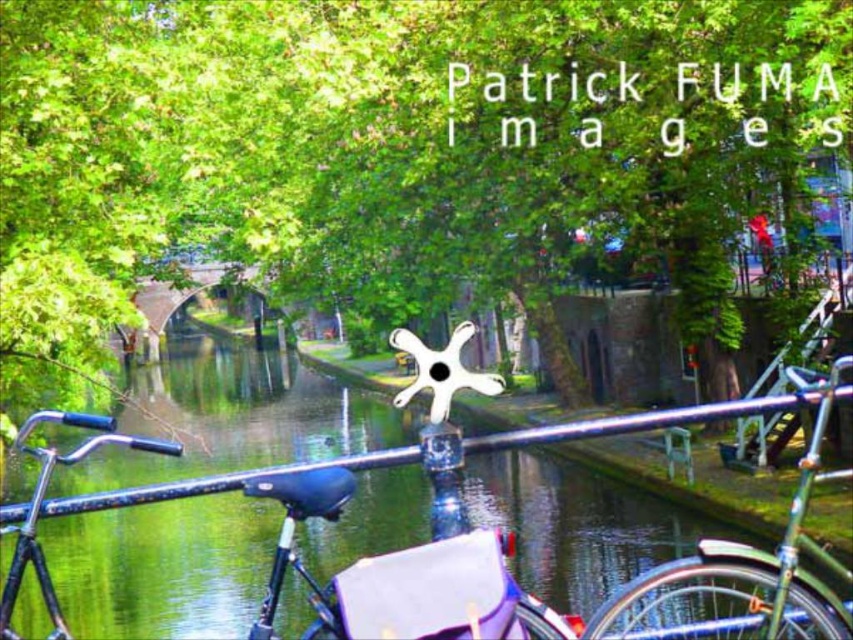
Question: Among these objects, which one is nearest to the camera?

Choices:
 (A) green leafy tree at center
 (B) shiny blue bicycle at center

Answer: (B)

Question: Among these objects, which one is farthest from the camera?

Choices:
 (A) shiny blue bicycle at center
 (B) green matte bicycle at center
 (C) green leafy tree at center
 (D) green smooth water at center

Answer: (C)

Question: Observing the image, what is the correct spatial positioning of green leafy tree at center in reference to shiny blue bicycle at center?

Choices:
 (A) left
 (B) right

Answer: (B)

Question: Which of the following is the farthest from the observer?

Choices:
 (A) (708, 554)
 (B) (436, 452)
 (C) (398, 554)
 (D) (630, 216)

Answer: (D)

Question: Is green leafy tree at center below shiny blue bicycle at center?

Choices:
 (A) yes
 (B) no

Answer: (B)

Question: Does shiny blue bicycle at center appear under green matte bicycle at center?

Choices:
 (A) no
 (B) yes

Answer: (A)